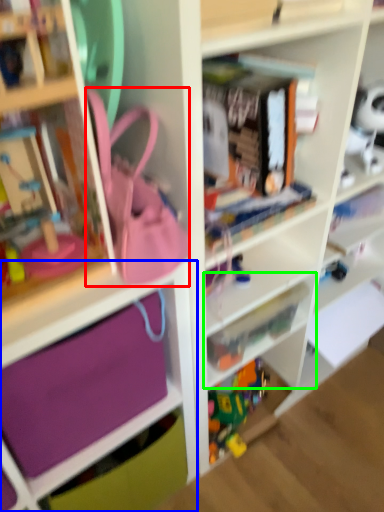
Question: Considering the real-world distances, which object is closest to accessory (highlighted by a red box)? cabinet (highlighted by a blue box) or shelf (highlighted by a green box).

Choices:
 (A) cabinet
 (B) shelf

Answer: (A)